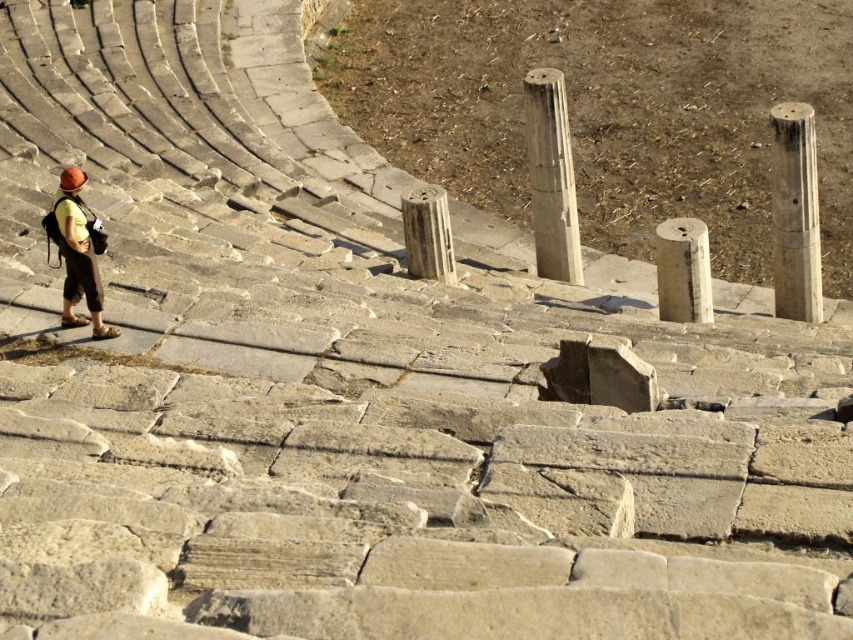
You are standing at the entrance of the ancient stone amphitheater and notice a point marked at coordinates (550,177). What object is located at that point?

The point at coordinates (550,177) marks the location of the smooth stone column at center.

Looking at this image, you are standing at the entrance of the amphitheater and want to take a photo of both the gray stone pillar at right and the smooth stone column at center. Which object should you aim your camera at first to ensure both are in frame?

Answer: You should aim your camera at the gray stone pillar at right first because it is positioned below the smooth stone column at center, so adjusting the frame to include the lower pillar will naturally include the column above it.